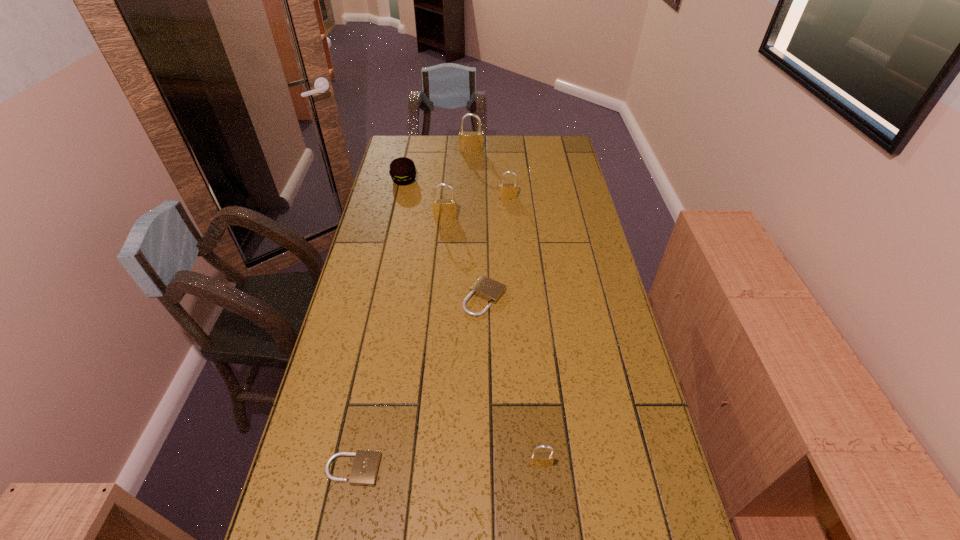
The height and width of the screenshot is (540, 960). I want to click on object situated at the far edge, so click(x=469, y=142).

This screenshot has height=540, width=960. Find the location of `patty that is at the left edge`. patty that is at the left edge is located at coordinates click(x=402, y=170).

Image resolution: width=960 pixels, height=540 pixels. Find the location of `padlock that is positioned at the left edge`. padlock that is positioned at the left edge is located at coordinates (365, 467).

The image size is (960, 540). Find the location of `free space at the far edge`. free space at the far edge is located at coordinates (495, 148).

Identify the location of free space at the left edge of the desktop. (414, 191).

Find the location of a particular element. The image size is (960, 540). vacant space at the right edge of the desktop is located at coordinates (636, 488).

In the image, there is a desktop. At what (x,y) coordinates should I click in order to perform the action: click on vacant space at the far right corner. Please return your answer as a coordinate pair (x, y). Image resolution: width=960 pixels, height=540 pixels. Looking at the image, I should click on (564, 156).

The image size is (960, 540). In order to click on free space between the nearest brass padlock and the shortest object in this screenshot , I will do `click(446, 467)`.

I want to click on blank region between the patty and the shortest padlock, so click(x=378, y=325).

The width and height of the screenshot is (960, 540). I want to click on free space that is in between the nearest brass padlock and the third farthest brass padlock, so click(x=493, y=340).